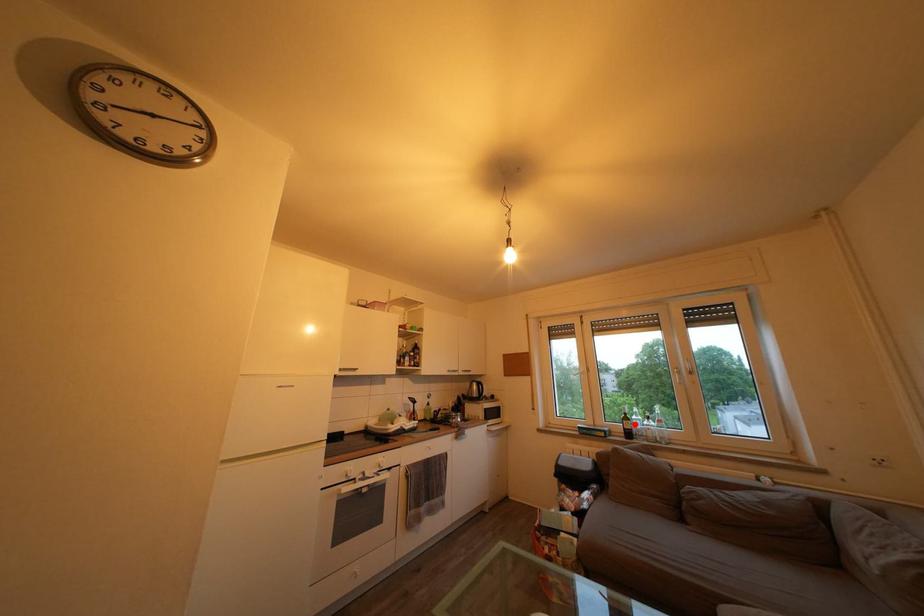
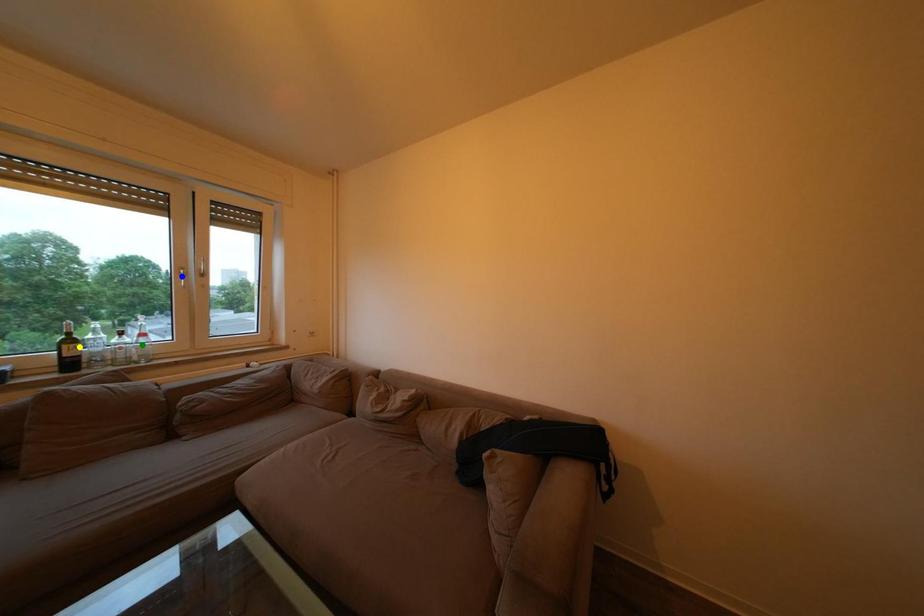
Question: I am providing you with two images of the same scene from different viewpoints. A red point is marked on the first image. You are given multiple points on the second image. Can you choose the point in image 2 that corresponds to the point in image 1?

Choices:
 (A) green point
 (B) blue point
 (C) yellow point

Answer: (C)